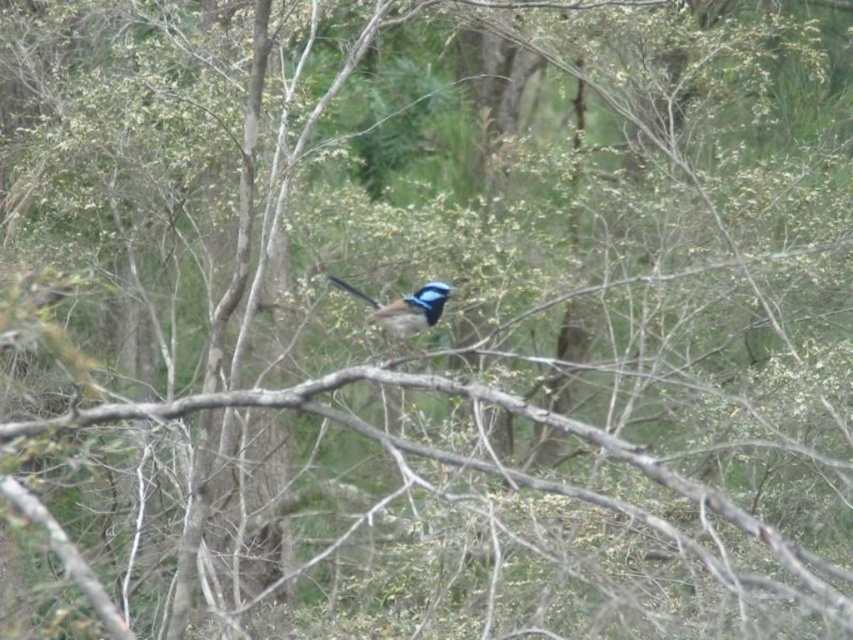
You are a photographer trying to capture the blue glossy bird at center perched on the brown wood at center. Based on their sizes, which object would appear larger in your photo?

The brown wood at center is much taller than the blue glossy bird at center, so it would appear larger in the photo.